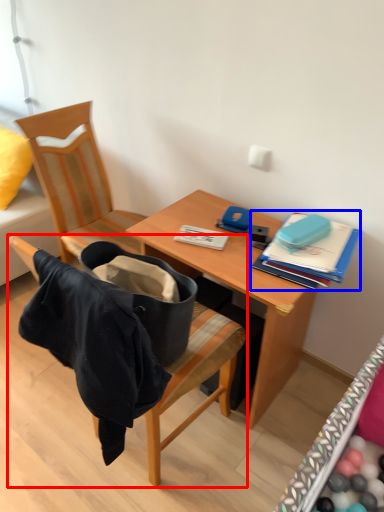
Question: Which object is closer to the camera taking this photo, chair (highlighted by a red box) or book (highlighted by a blue box)?

Choices:
 (A) chair
 (B) book

Answer: (A)